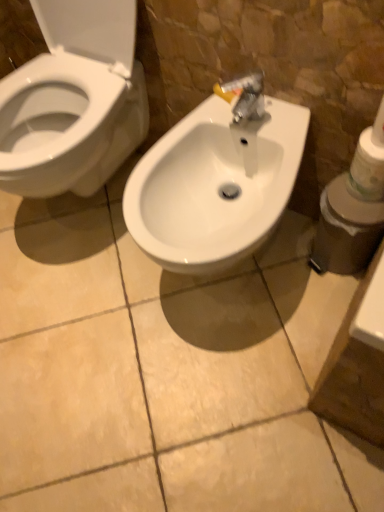
Question: Would you say white plastic container at right is a long distance from white matte toilet paper at right?

Choices:
 (A) no
 (B) yes

Answer: (A)

Question: Can you confirm if white plastic container at right is positioned to the left of white matte toilet paper at right?

Choices:
 (A) yes
 (B) no

Answer: (A)

Question: Is white plastic container at right shorter than white matte toilet paper at right?

Choices:
 (A) no
 (B) yes

Answer: (A)

Question: Does white plastic container at right turn towards white matte toilet paper at right?

Choices:
 (A) no
 (B) yes

Answer: (A)

Question: Is white plastic container at right closer to the viewer compared to white matte toilet paper at right?

Choices:
 (A) yes
 (B) no

Answer: (B)

Question: Can you confirm if white plastic container at right is positioned to the right of white matte toilet paper at right?

Choices:
 (A) yes
 (B) no

Answer: (B)

Question: Would you say white matte toilet paper at right is outside white plastic container at right?

Choices:
 (A) yes
 (B) no

Answer: (A)

Question: Is white matte toilet paper at right at the left side of white plastic container at right?

Choices:
 (A) yes
 (B) no

Answer: (B)

Question: From the image's perspective, is white matte toilet paper at right below white plastic container at right?

Choices:
 (A) no
 (B) yes

Answer: (A)

Question: From the image's perspective, is white matte toilet paper at right on top of white plastic container at right?

Choices:
 (A) yes
 (B) no

Answer: (A)

Question: Is white matte toilet paper at right with white plastic container at right?

Choices:
 (A) yes
 (B) no

Answer: (B)

Question: Is white matte toilet paper at right shorter than white plastic container at right?

Choices:
 (A) yes
 (B) no

Answer: (A)

Question: Is white glossy sink at center positioned beyond the bounds of white matte toilet paper at right?

Choices:
 (A) no
 (B) yes

Answer: (B)